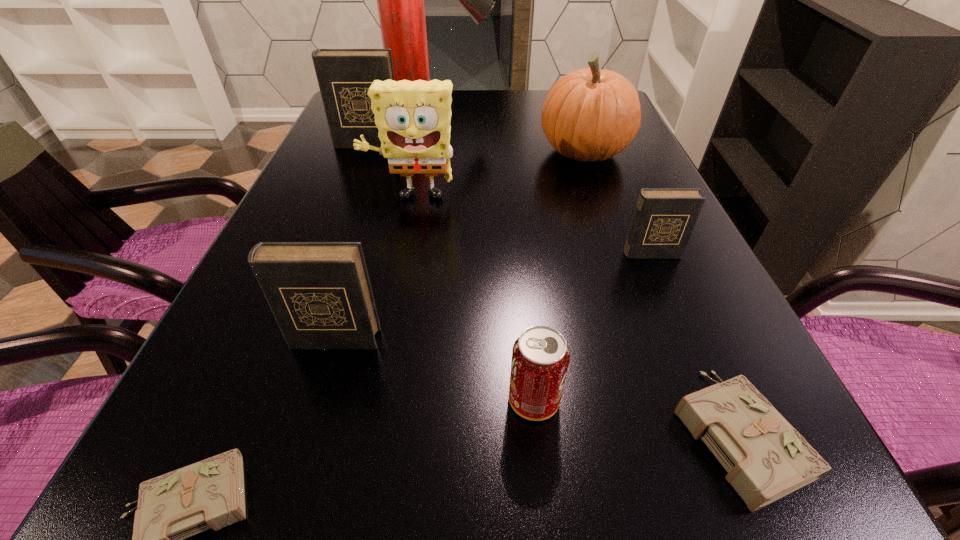
I want to click on the third shortest diary, so click(664, 219).

Locate an element on the screen. The width and height of the screenshot is (960, 540). soda can is located at coordinates (540, 356).

Locate an element on the screen. The height and width of the screenshot is (540, 960). the right green diary is located at coordinates (766, 458).

Locate an element on the screen. the second shortest object is located at coordinates (766, 458).

Find the location of a particular element. This screenshot has width=960, height=540. free spot located at the nozzle end of the fire extinguisher is located at coordinates (540, 98).

This screenshot has height=540, width=960. I want to click on vacant space located 0.380m on the stem of the pumpkin, so click(387, 152).

Where is `vacant space situated 0.240m on the stem of the pumpkin`? The width and height of the screenshot is (960, 540). vacant space situated 0.240m on the stem of the pumpkin is located at coordinates (443, 152).

The height and width of the screenshot is (540, 960). What are the coordinates of `free space located on the stem of the pumpkin` in the screenshot? It's located at (435, 152).

You are a GUI agent. You are given a task and a screenshot of the screen. Output one action in this format:
    pyautogui.click(x=<x>, y=<y>)
    Task: Click on the vacant space situated 0.100m on the face of the yellow sponge
    The image size is (960, 540).
    Given the screenshot: What is the action you would take?
    pyautogui.click(x=403, y=242)

You are a GUI agent. You are given a task and a screenshot of the screen. Output one action in this format:
    pyautogui.click(x=<x>, y=<y>)
    Task: Click on the vacant space located 0.090m on the front cover of the biggest dark diary
    The image size is (960, 540).
    Given the screenshot: What is the action you would take?
    tap(359, 167)